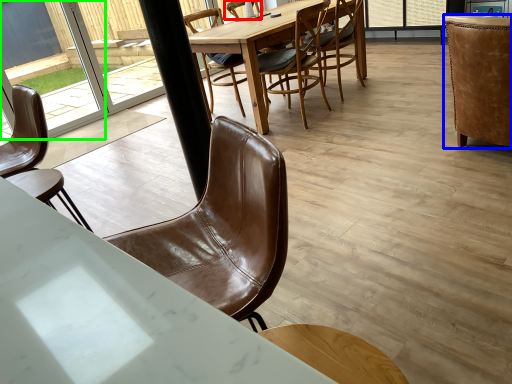
Question: Considering the real-world distances, which object is farthest from chair (highlighted by a red box)? chair (highlighted by a blue box) or glass door (highlighted by a green box)?

Choices:
 (A) chair
 (B) glass door

Answer: (B)